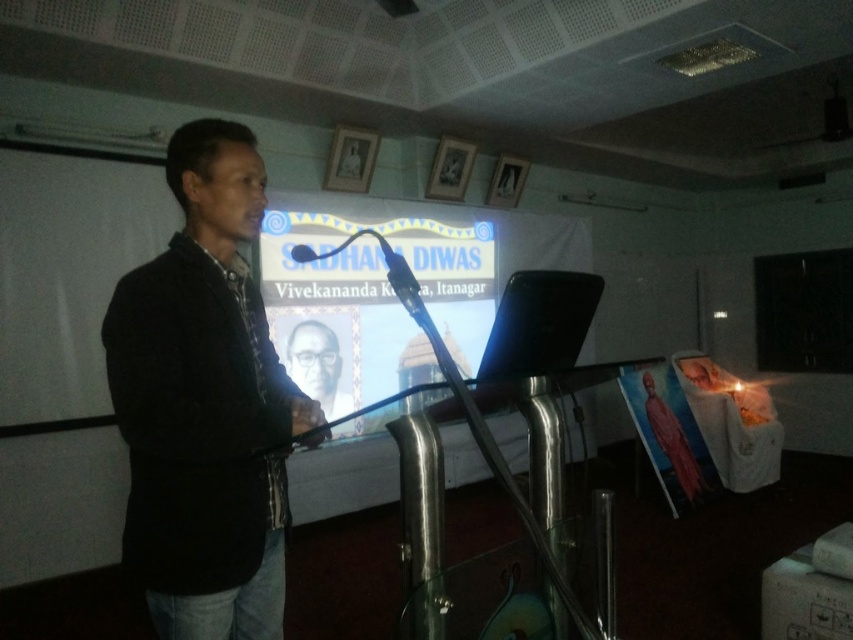
Question: Is matte black screen at center to the right of matte black portrait at center from the viewer's perspective?

Choices:
 (A) yes
 (B) no

Answer: (A)

Question: Estimate the real-world distances between objects in this image. Which object is closer to the matte black screen at center?

Choices:
 (A) matte black microphone at center
 (B) matte black portrait at center
 (C) black matte jacket at left

Answer: (B)

Question: Which point is closer to the camera?

Choices:
 (A) (196, 198)
 (B) (334, 417)

Answer: (A)

Question: Can you confirm if matte black portrait at center is positioned above matte black microphone at center?

Choices:
 (A) yes
 (B) no

Answer: (B)

Question: From the image, what is the correct spatial relationship of matte black portrait at center in relation to matte black microphone at center?

Choices:
 (A) left
 (B) right

Answer: (A)

Question: Which of the following is the farthest from the observer?

Choices:
 (A) matte black microphone at center
 (B) matte black screen at center
 (C) black matte jacket at left
 (D) matte black portrait at center

Answer: (D)